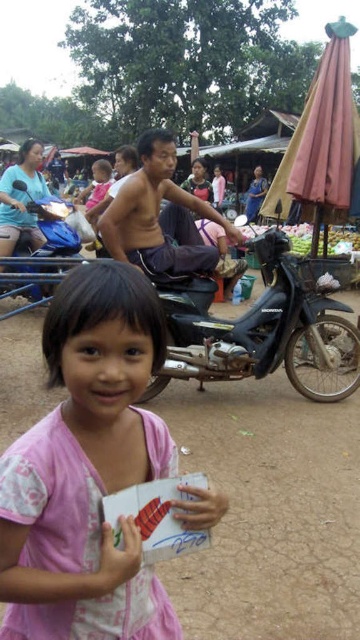
Between point (327, 324) and point (27, 262), which one is positioned behind?

The point (27, 262) is behind.

Is black matte motorcycle at center in front of blue matte motorcycle at center?

Yes, it is.

The image size is (360, 640). What do you see at coordinates (258, 326) in the screenshot? I see `black matte motorcycle at center` at bounding box center [258, 326].

Locate an element on the screen. The height and width of the screenshot is (640, 360). black matte motorcycle at center is located at coordinates (258, 326).

Does point (144, 256) lie in front of point (28, 204)?

That is True.

Who is lower down, shiny purple pants at center or blue matte motorcycle at center?

Positioned lower is blue matte motorcycle at center.

Which is behind, point (141, 237) or point (12, 276)?

The point (141, 237) is behind.

You are a GUI agent. You are given a task and a screenshot of the screen. Output one action in this format:
    pyautogui.click(x=<x>, y=<y>)
    Task: Click on the shiny purple pants at center
    
    Given the screenshot: What is the action you would take?
    pyautogui.click(x=159, y=216)

Is point (60, 348) farther from camera compared to point (343, 360)?

No.

Locate an element on the screen. This screenshot has width=360, height=640. pink fabric child at center is located at coordinates 87,468.

Between point (93, 634) and point (273, 356), which one is positioned behind?

Positioned behind is point (273, 356).

Locate an element on the screen. pink fabric child at center is located at coordinates (87, 468).